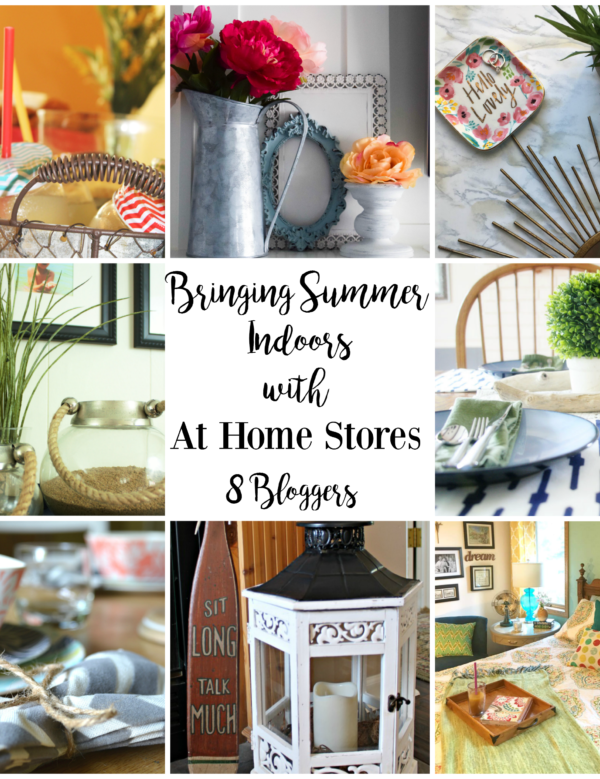
Identify the location of tied napkins. This screenshot has height=779, width=600. (106, 707), (109, 678).